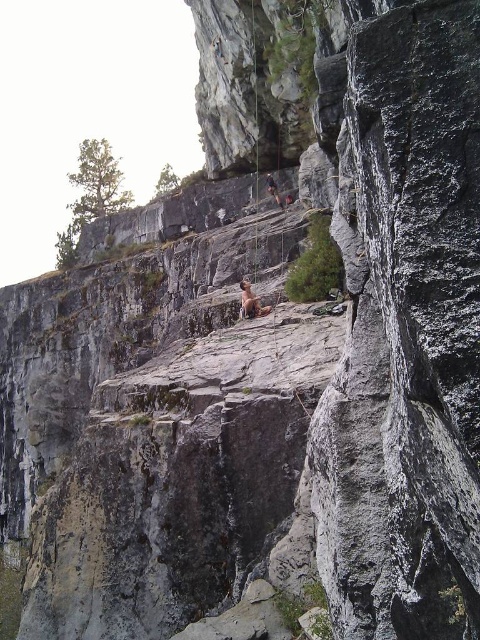
You are a hiker trying to determine the best path up the cliff. You notice two objects at the center of your view. Which object is closer to you, the smooth tan skin at center or the matte gray rock climber at center?

The smooth tan skin at center is closer to you because it is in front of the matte gray rock climber at center.

You are a safety inspector reviewing this climbing scene. The smooth tan skin at center and the matte gray rock climber at center are both visible. Which object is located below the other?

The smooth tan skin at center is positioned under the matte gray rock climber at center, meaning the smooth tan skin is below the matte gray rock climber.